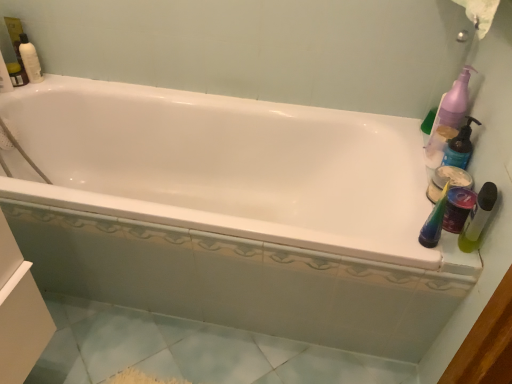
Question: Based on their positions, is matte white container at right, arranged as the 1th cleaning product when ordered from the bottom, located to the left or right of purple plastic pump bottle at upper right, arranged as the first cleaning product when viewed from the top?

Choices:
 (A) right
 (B) left

Answer: (B)

Question: Is matte white container at right, arranged as the 1th cleaning product when ordered from the bottom, inside or outside of purple plastic pump bottle at upper right, which is counted as the 2th cleaning product, starting from the bottom?

Choices:
 (A) inside
 (B) outside

Answer: (B)

Question: Estimate the real-world distances between objects in this image. Which object is farther from the white glossy bathtub at center?

Choices:
 (A) green matte bottle at right, the 2th mouthwash viewed from the front
 (B) matte white container at right, which is the second cleaning product from top to bottom
 (C) green matte bottle at right, marked as the 2th mouthwash in a back-to-front arrangement
 (D) purple plastic pump bottle at upper right, arranged as the first cleaning product when viewed from the top

Answer: (C)

Question: Which object is positioned closest to the green matte bottle at right, the 1th mouthwash positioned from the back?

Choices:
 (A) white glossy bathtub at center
 (B) matte white container at right, arranged as the 1th cleaning product when ordered from the bottom
 (C) green matte bottle at right, placed as the 1th mouthwash when sorted from front to back
 (D) purple plastic pump bottle at upper right, which is counted as the 2th cleaning product, starting from the bottom

Answer: (B)